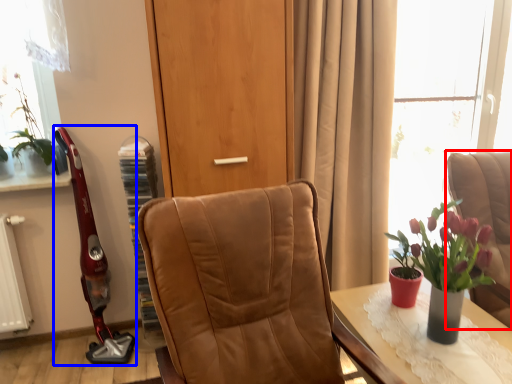
Question: Which object is closer to the camera taking this photo, chair (highlighted by a red box) or open (highlighted by a blue box)?

Choices:
 (A) chair
 (B) open

Answer: (A)